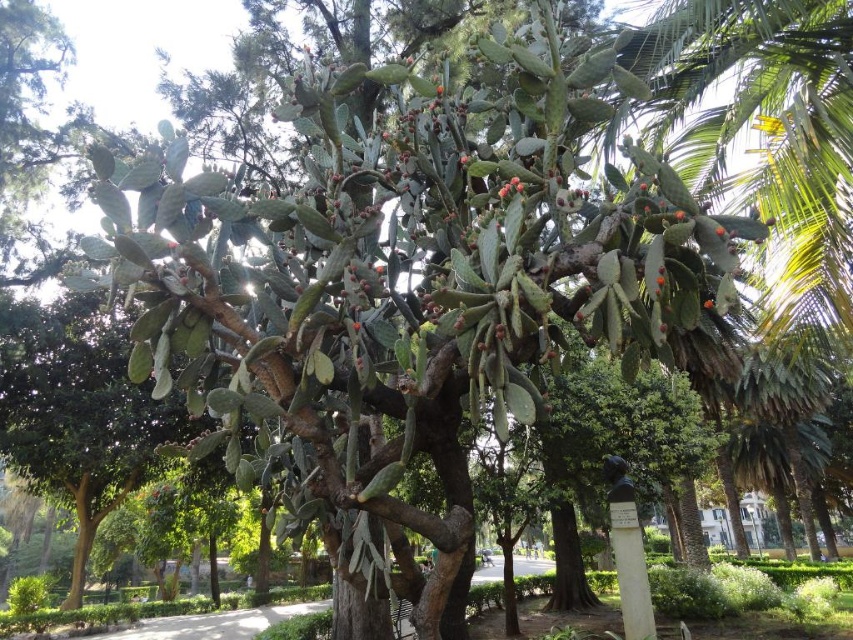
Question: Is green leafy palm tree at right below red matte cactus at center?

Choices:
 (A) no
 (B) yes

Answer: (B)

Question: Which point is farther from the camera taking this photo?

Choices:
 (A) (708, 301)
 (B) (782, 477)

Answer: (B)

Question: Is green leafy palm tree at right positioned before red matte cactus at center?

Choices:
 (A) no
 (B) yes

Answer: (A)

Question: Is green leafy palm tree at right thinner than red matte cactus at center?

Choices:
 (A) no
 (B) yes

Answer: (A)